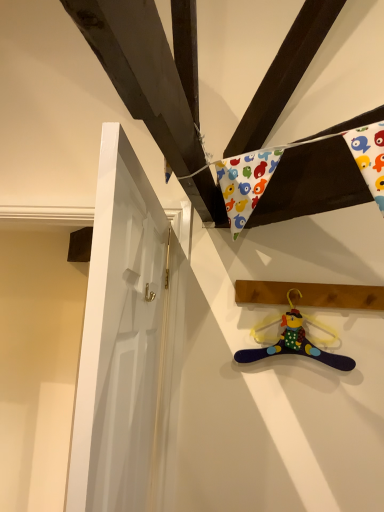
Question: Does wooden plank at upper right appear on the left side of white glossy door at left?

Choices:
 (A) yes
 (B) no

Answer: (B)

Question: Is white glossy door at left at the back of wooden plank at upper right?

Choices:
 (A) yes
 (B) no

Answer: (B)

Question: Considering the relative sizes of wooden plank at upper right and white glossy door at left in the image provided, is wooden plank at upper right shorter than white glossy door at left?

Choices:
 (A) yes
 (B) no

Answer: (A)

Question: Would you consider wooden plank at upper right to be distant from white glossy door at left?

Choices:
 (A) no
 (B) yes

Answer: (A)

Question: Does wooden plank at upper right have a larger size compared to white glossy door at left?

Choices:
 (A) no
 (B) yes

Answer: (A)

Question: In terms of width, does multicolored fabric hanger at lower right look wider or thinner when compared to multicolored fabric hanger at lower right?

Choices:
 (A) wide
 (B) thin

Answer: (A)

Question: From the image's perspective, relative to multicolored fabric hanger at lower right, is multicolored fabric hanger at lower right above or below?

Choices:
 (A) above
 (B) below

Answer: (B)

Question: In terms of size, does multicolored fabric hanger at lower right appear bigger or smaller than multicolored fabric hanger at lower right?

Choices:
 (A) small
 (B) big

Answer: (B)

Question: From a real-world perspective, is multicolored fabric hanger at lower right above or below multicolored fabric hanger at lower right?

Choices:
 (A) below
 (B) above

Answer: (A)

Question: Considering their positions, is white glossy door at left located in front of or behind multicolored fabric hanger at lower right?

Choices:
 (A) front
 (B) behind

Answer: (A)

Question: From a real-world perspective, relative to multicolored fabric hanger at lower right, is white glossy door at left vertically above or below?

Choices:
 (A) below
 (B) above

Answer: (A)

Question: In terms of width, does white glossy door at left look wider or thinner when compared to multicolored fabric hanger at lower right?

Choices:
 (A) wide
 (B) thin

Answer: (A)

Question: In terms of height, does white glossy door at left look taller or shorter compared to multicolored fabric hanger at lower right?

Choices:
 (A) short
 (B) tall

Answer: (B)

Question: From a real-world perspective, is multicolored fabric hanger at lower right physically located above or below multicolored fabric hanger at lower right?

Choices:
 (A) below
 (B) above

Answer: (B)

Question: From their relative heights in the image, would you say multicolored fabric hanger at lower right is taller or shorter than multicolored fabric hanger at lower right?

Choices:
 (A) tall
 (B) short

Answer: (B)